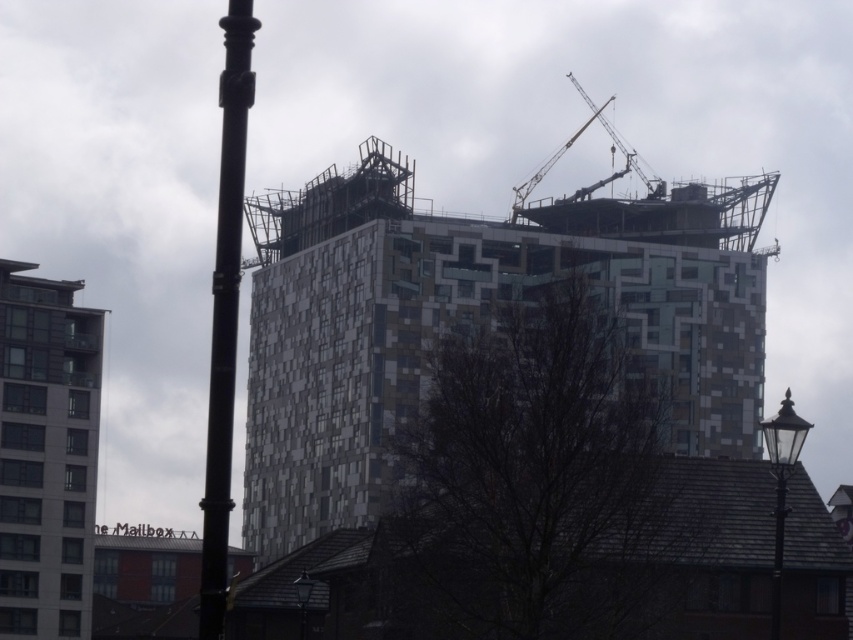
Question: Can you confirm if geometric mosaic building at center is thinner than black glass lamp post at lower center?

Choices:
 (A) yes
 (B) no

Answer: (B)

Question: Which object is farther from the camera taking this photo?

Choices:
 (A) black glass lamp post at lower right
 (B) gray concrete building at lower left

Answer: (B)

Question: Is black glass lamp post at lower right in front of black glass lamp post at lower center?

Choices:
 (A) no
 (B) yes

Answer: (B)

Question: Which point is closer to the camera?

Choices:
 (A) (300, 625)
 (B) (628, 166)
 (C) (717, 320)
 (D) (776, 474)

Answer: (D)

Question: Among these points, which one is nearest to the camera?

Choices:
 (A) (360, 253)
 (B) (776, 528)
 (C) (57, 412)
 (D) (519, 198)

Answer: (B)

Question: Is geometric mosaic building at center positioned before metallic gray crane at upper center?

Choices:
 (A) no
 (B) yes

Answer: (B)